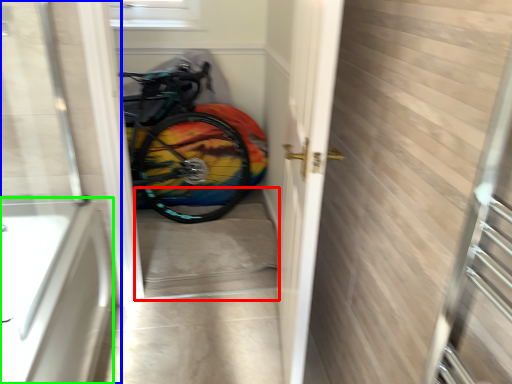
Question: Which object is positioned farthest from stairwell (highlighted by a red box)? Select from door (highlighted by a blue box) and bath (highlighted by a green box).

Choices:
 (A) door
 (B) bath

Answer: (A)